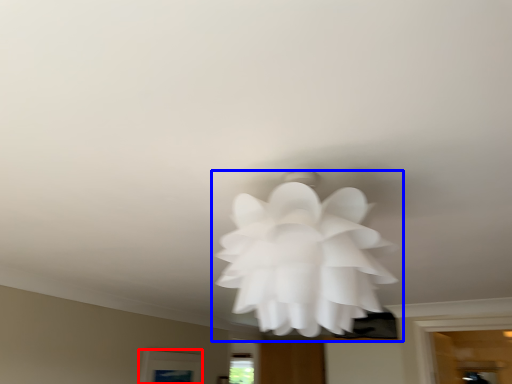
Question: Which point is closer to the camera, window (highlighted by a red box) or flower (highlighted by a blue box)?

Choices:
 (A) window
 (B) flower

Answer: (B)